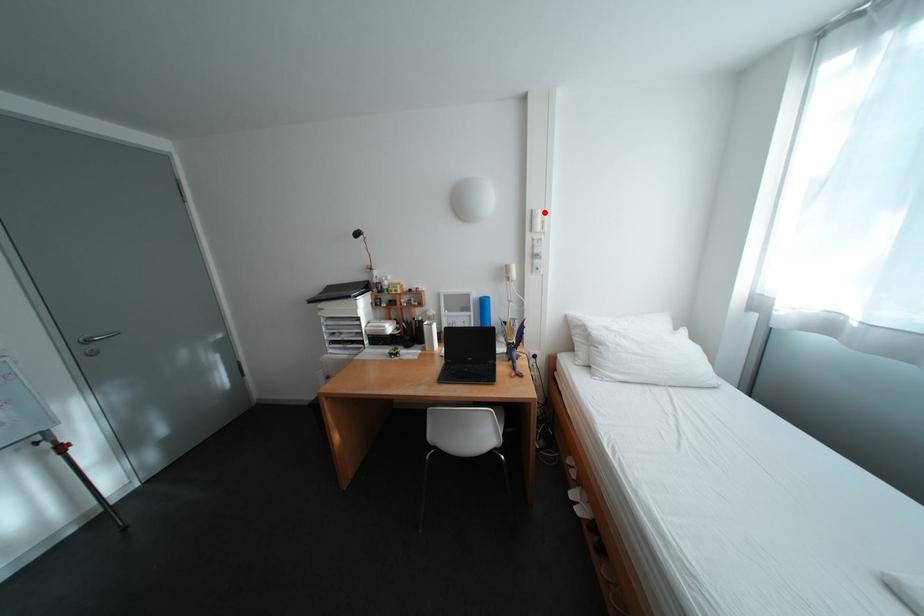
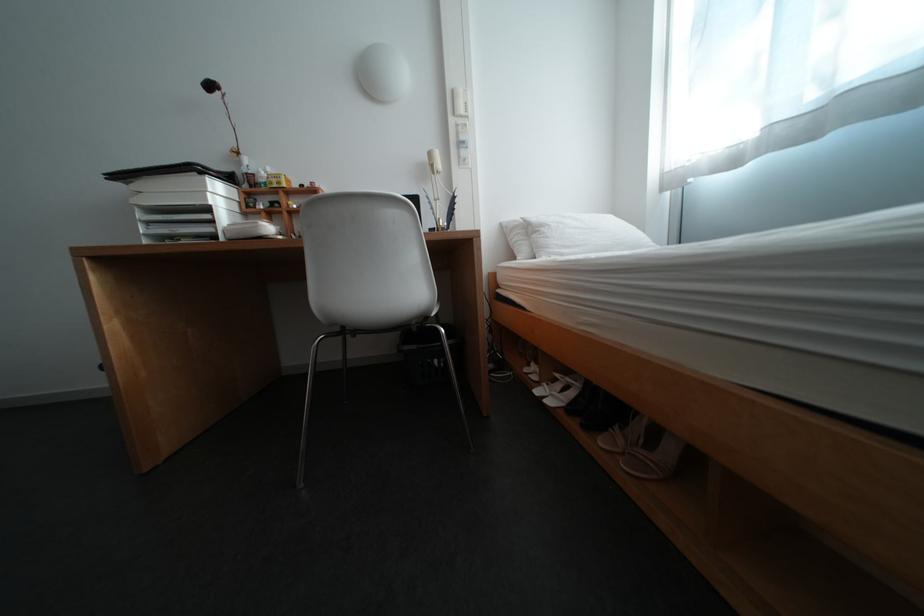
Locate, in the second image, the point that corresponds to the highlighted location in the first image.

(466, 92)